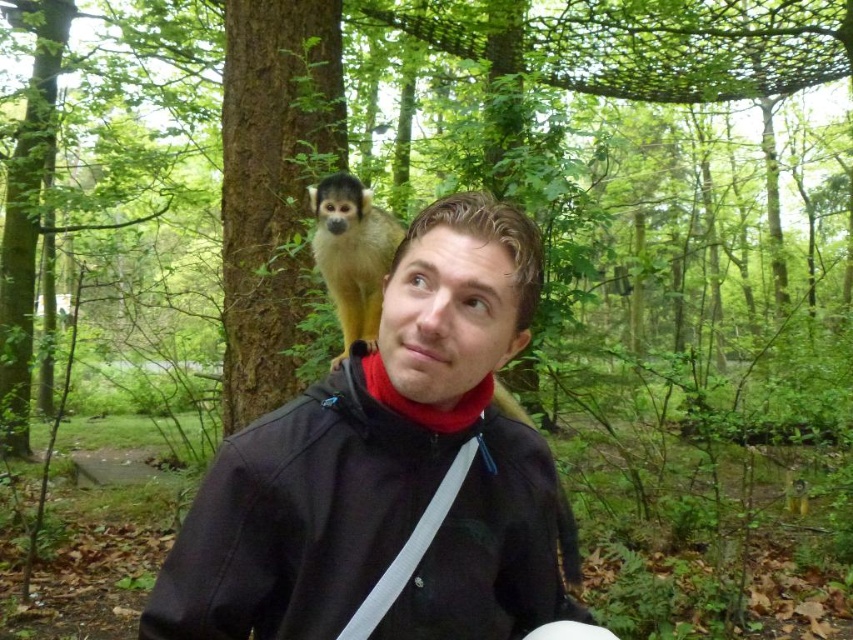
You are a hiker who just arrived at the forest. You see the matte black jacket at center and the squirrel monkey at upper center. Which object is higher up in the scene?

The squirrel monkey at upper center is higher up in the scene than the matte black jacket at center.

You are a photographer trying to capture both the matte black jacket at center and the squirrel monkey at upper center in a single frame. Based on their positions, which object should you adjust your camera to focus on first to ensure both are in the shot?

The matte black jacket at center is to the right of the squirrel monkey at upper center, so you should focus on the squirrel monkey at upper center first to ensure both are in the frame.

You are a photographer carrying a camera with a 3.5 feet focal length lens. You want to capture both the matte black jacket at center and the squirrel monkey at upper center in the same frame. Can you do this without moving the camera?

The distance between the matte black jacket at center and the squirrel monkey at upper center is 4.44 feet. Since the camera lens has a 3.5 feet focal length, which is shorter than the distance between them, you can capture both in the same frame without moving the camera.